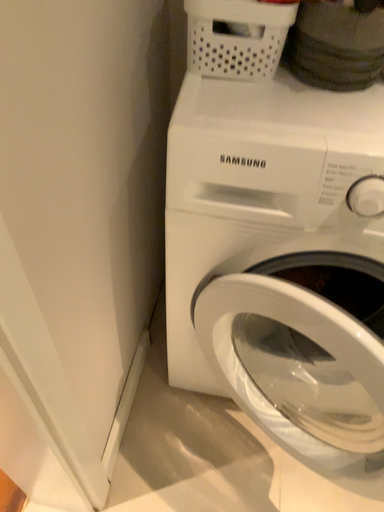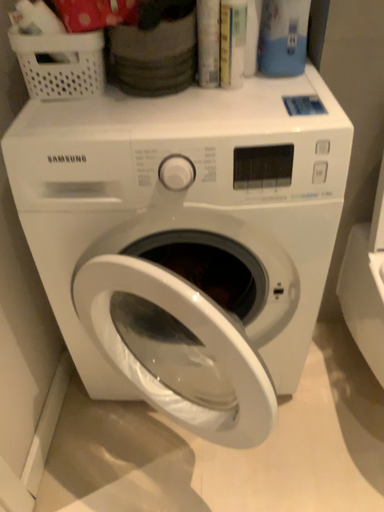
Question: How did the camera likely rotate when shooting the video?

Choices:
 (A) rotated upward
 (B) rotated downward

Answer: (A)